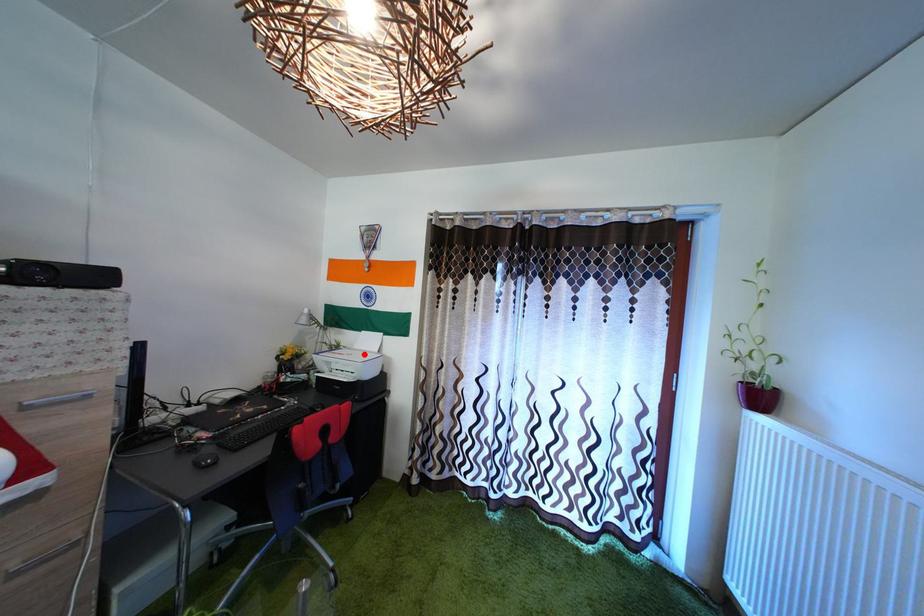
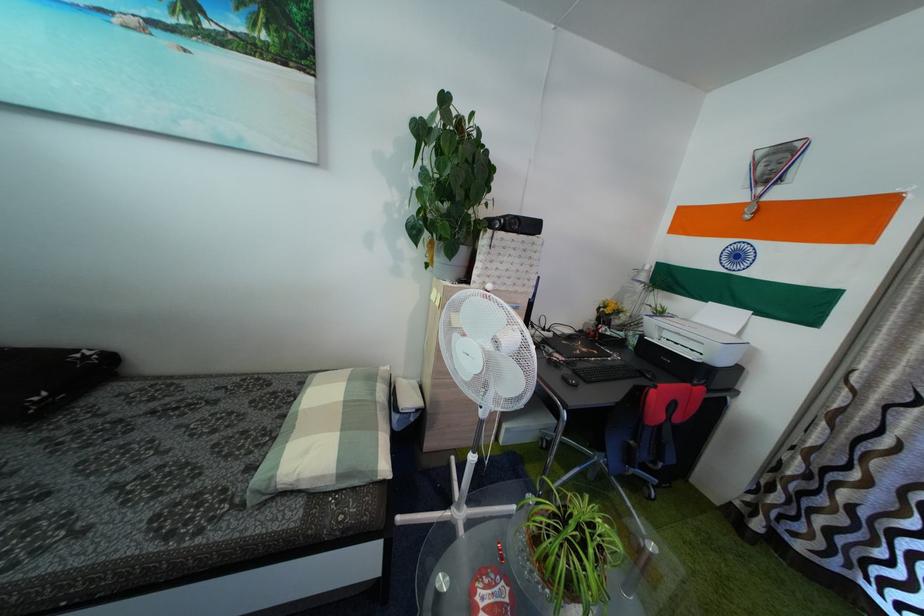
The point at the highlighted location is marked in the first image. Where is the corresponding point in the second image?

(703, 328)